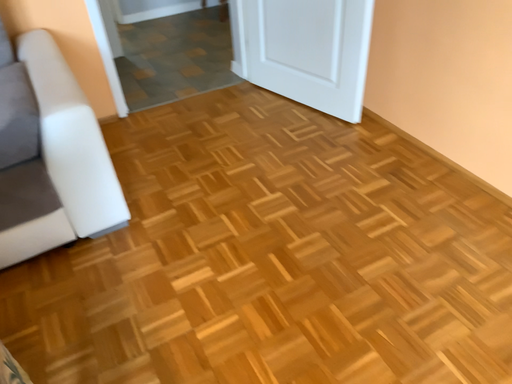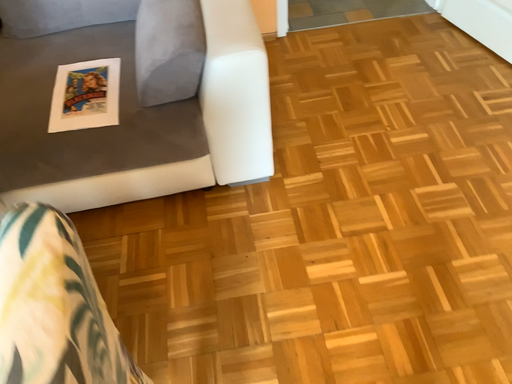
Question: Which way did the camera rotate in the video?

Choices:
 (A) rotated right
 (B) rotated left

Answer: (B)